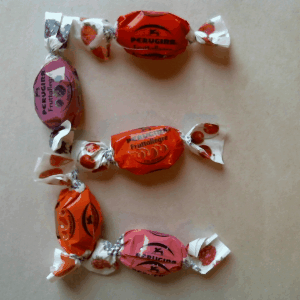
At what (x,y) coordinates should I click in order to perform the action: click on table. Please return your answer as a coordinate pair (x, y). Image resolution: width=300 pixels, height=300 pixels. Looking at the image, I should click on (256, 92), (91, 86).